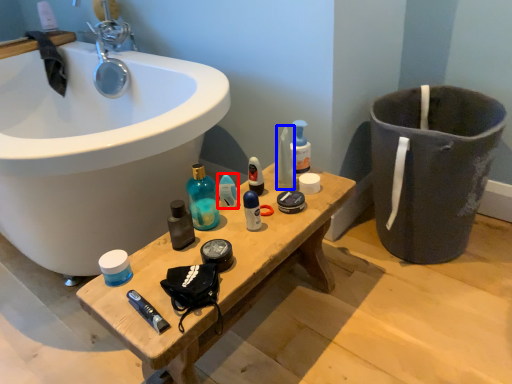
Question: Which point is closer to the camera, toiletry (highlighted by a red box) or toiletry (highlighted by a blue box)?

Choices:
 (A) toiletry
 (B) toiletry

Answer: (A)